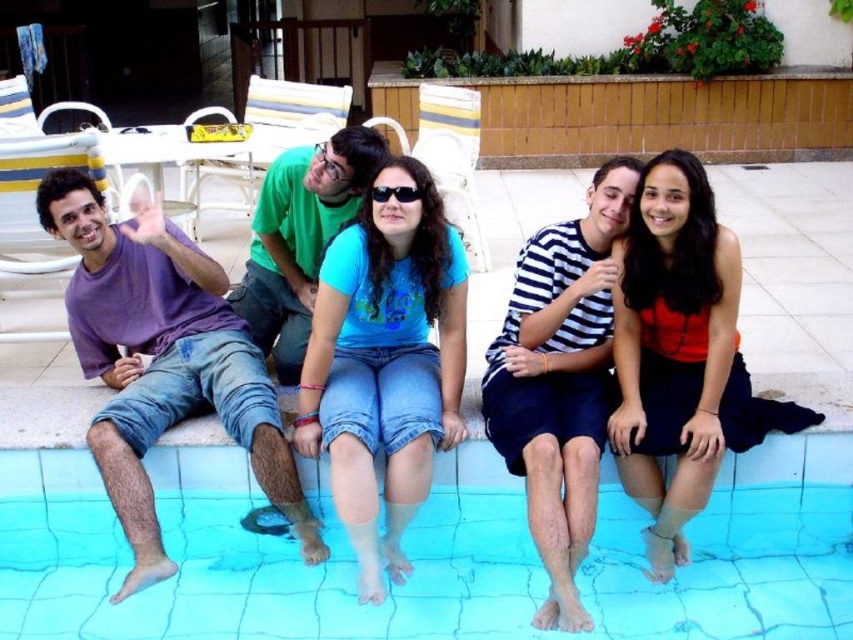
Which is more to the right, striped cotton shirt at center or black plastic sunglasses at center?

Positioned to the right is striped cotton shirt at center.

Which is behind, point (598, 173) or point (405, 188)?

The point (598, 173) is behind.

Locate an element on the screen. striped cotton shirt at center is located at coordinates (560, 380).

Who is more forward, (378, 380) or (602, 164)?

Point (378, 380) is more forward.

Which is below, blue matte shirt at center or striped cotton shirt at center?

striped cotton shirt at center

Which is behind, point (444, 308) or point (595, 420)?

The point (444, 308) is behind.

The image size is (853, 640). I want to click on blue matte shirt at center, so click(386, 362).

Is purple cotton t-shirt at left positioned at the back of striped cotton shirt at center?

No, it is not.

In order to click on purple cotton t-shirt at left in this screenshot , I will do `click(161, 362)`.